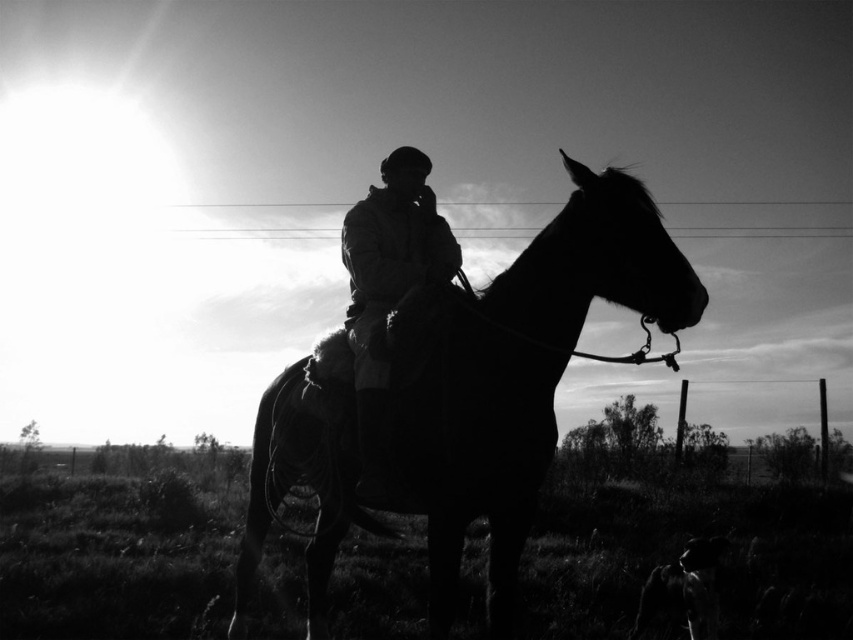
You are a photographer analyzing this black and white photo. You notice the silhouette glossy horse at center and the silhouette leather jacket at center. Based on their positions, which object is closer to the right edge of the photo?

The silhouette glossy horse at center is to the right of the silhouette leather jacket at center, so it is closer to the right edge of the photo.

Based on the scene description, what object is located at the coordinates point (x=515, y=374)?

The point (x=515, y=374) marks the silhouette glossy horse at center.